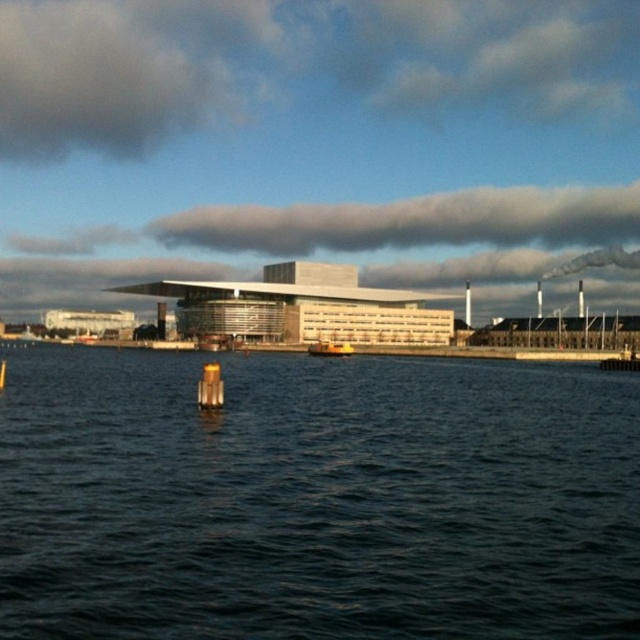
Question: Which point is closer to the camera?

Choices:
 (A) 518,225
 (B) 97,490

Answer: (B)

Question: Which of the following is the closest to the observer?

Choices:
 (A) (241, 218)
 (B) (321, 410)
 (C) (346, 355)

Answer: (B)

Question: Does dark blue water at center have a larger size compared to yellow rubber boat at center?

Choices:
 (A) no
 (B) yes

Answer: (B)

Question: Estimate the real-world distances between objects in this image. Which object is closer to the dark blue water at center?

Choices:
 (A) yellow rubber boat at center
 (B) white fluffy cloud at upper center

Answer: (A)

Question: Is dark blue water at center positioned at the back of yellow rubber boat at center?

Choices:
 (A) no
 (B) yes

Answer: (A)

Question: Can you confirm if dark blue water at center is bigger than white fluffy cloud at upper center?

Choices:
 (A) yes
 (B) no

Answer: (B)